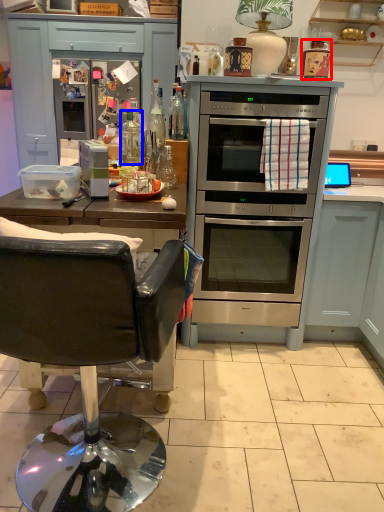
Question: Which of the following is the farthest to the observer, appliance (highlighted by a red box) or bottle (highlighted by a blue box)?

Choices:
 (A) appliance
 (B) bottle

Answer: (B)